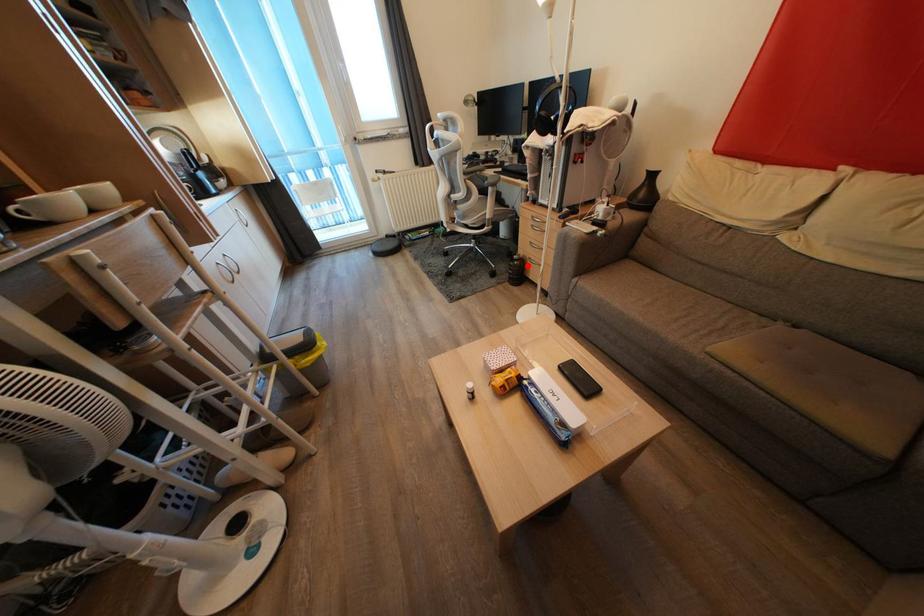
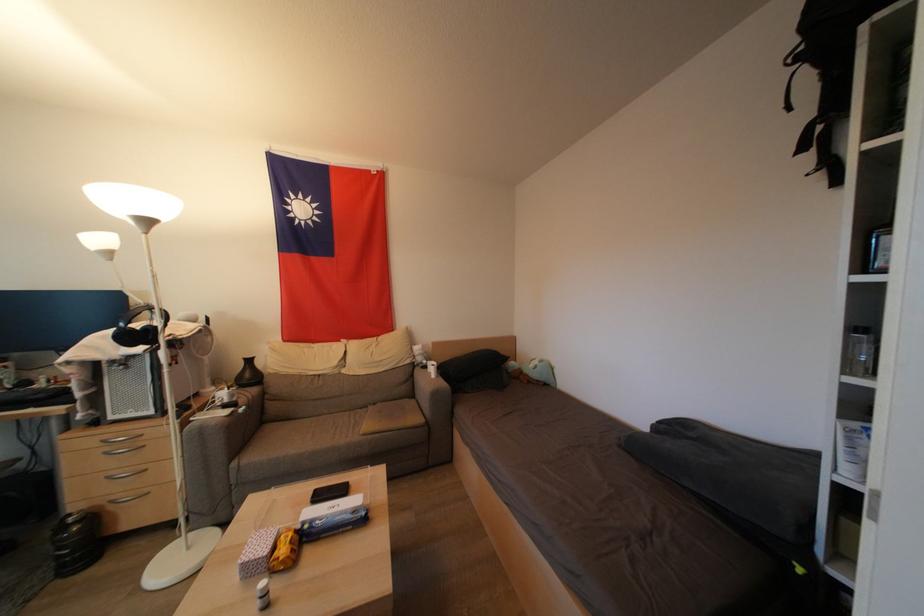
Where in the second image is the point corresponding to the highlighted location from the first image?

(99, 521)